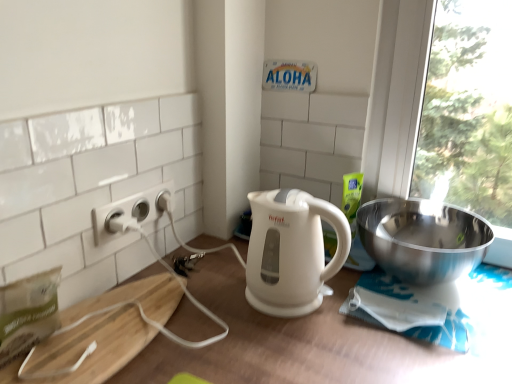
Question: Does white plastic power outlet at left touch white matte table at center?

Choices:
 (A) no
 (B) yes

Answer: (A)

Question: Can you confirm if white plastic power outlet at left is smaller than white matte table at center?

Choices:
 (A) no
 (B) yes

Answer: (B)

Question: Is white plastic power outlet at left oriented towards white matte table at center?

Choices:
 (A) no
 (B) yes

Answer: (A)

Question: Does white plastic power outlet at left have a lesser width compared to white matte table at center?

Choices:
 (A) yes
 (B) no

Answer: (A)

Question: Is white plastic power outlet at left far from white matte table at center?

Choices:
 (A) no
 (B) yes

Answer: (A)

Question: Considering the positions of polished stainless steel bowl at right and white plastic power outlet at left in the image, is polished stainless steel bowl at right bigger or smaller than white plastic power outlet at left?

Choices:
 (A) small
 (B) big

Answer: (B)

Question: In the image, is polished stainless steel bowl at right on the left side or the right side of white plastic power outlet at left?

Choices:
 (A) left
 (B) right

Answer: (B)

Question: Is polished stainless steel bowl at right situated inside white plastic power outlet at left or outside?

Choices:
 (A) inside
 (B) outside

Answer: (B)

Question: From a real-world perspective, is polished stainless steel bowl at right positioned above or below white plastic power outlet at left?

Choices:
 (A) below
 (B) above

Answer: (A)

Question: From a real-world perspective, is white plastic power outlet at left positioned above or below white matte table at center?

Choices:
 (A) above
 (B) below

Answer: (A)

Question: Choose the correct answer: Is white plastic power outlet at left inside white matte table at center or outside it?

Choices:
 (A) inside
 (B) outside

Answer: (B)

Question: In terms of size, does white plastic power outlet at left appear bigger or smaller than white matte table at center?

Choices:
 (A) big
 (B) small

Answer: (B)

Question: In terms of width, does white plastic power outlet at left look wider or thinner when compared to white matte table at center?

Choices:
 (A) thin
 (B) wide

Answer: (A)

Question: Is white glossy electric kettle at center in front of or behind white plastic power outlet at left in the image?

Choices:
 (A) behind
 (B) front

Answer: (B)

Question: Is white glossy electric kettle at center bigger or smaller than white plastic power outlet at left?

Choices:
 (A) big
 (B) small

Answer: (A)